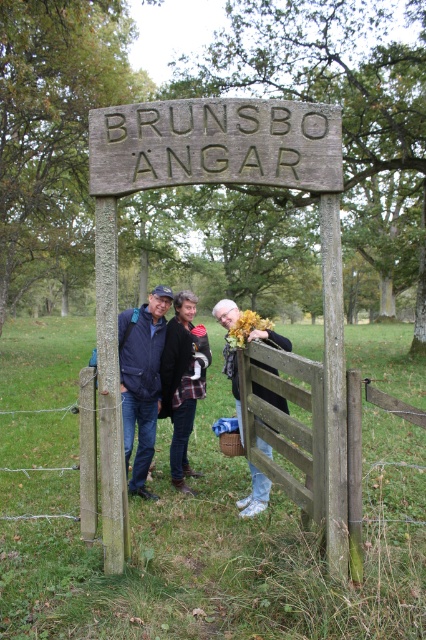
Question: Among these points, which one is nearest to the camera?

Choices:
 (A) (370, 392)
 (B) (267, 444)

Answer: (A)

Question: Among these points, which one is nearest to the camera?

Choices:
 (A) (80, 524)
 (B) (146, 417)

Answer: (A)

Question: Can you confirm if weathered wood sign at center is positioned to the right of flannel shirt at center?

Choices:
 (A) no
 (B) yes

Answer: (B)

Question: Which object is farther from the camera taking this photo?

Choices:
 (A) flannel shirt at center
 (B) plaid fabric jacket at center
 (C) blue denim jacket at center
 (D) leather jacket at center

Answer: (A)

Question: Does wooden gate at center appear on the left side of plaid fabric jacket at center?

Choices:
 (A) no
 (B) yes

Answer: (A)

Question: Is weathered wood sign at center positioned at the back of flannel shirt at center?

Choices:
 (A) yes
 (B) no

Answer: (B)